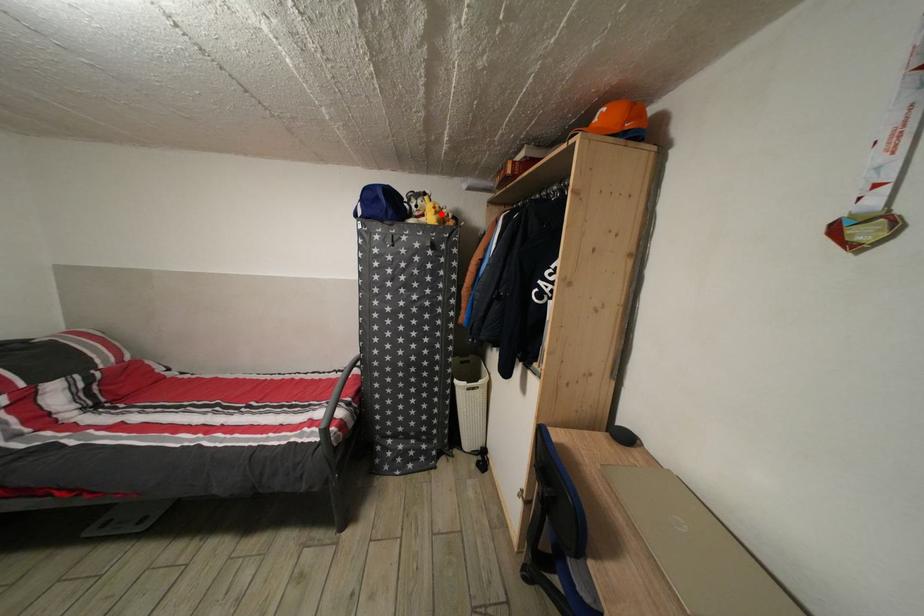
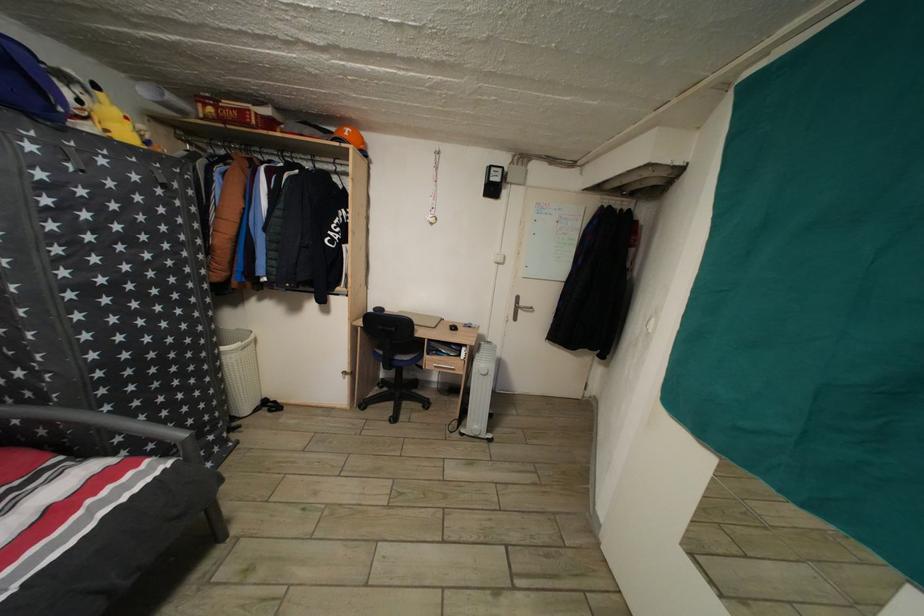
In the second image, find the point that corresponds to the highlighted location in the first image.

(134, 124)